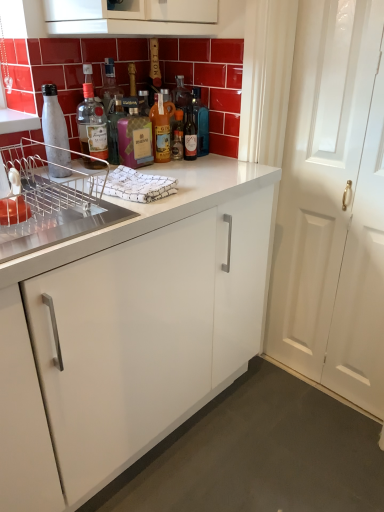
Question: Does pink glass bottle at center, the 3th bottle positioned from the left, have a larger size compared to matte glass bottle at upper center, which is the second bottle from left to right?

Choices:
 (A) no
 (B) yes

Answer: (B)

Question: Is pink glass bottle at center, the 3th bottle positioned from the left, further to camera compared to matte glass bottle at upper center, which is the fifth bottle in right-to-left order?

Choices:
 (A) no
 (B) yes

Answer: (A)

Question: From a real-world perspective, is pink glass bottle at center, the 3th bottle positioned from the left, on top of matte glass bottle at upper center, which is the fifth bottle in right-to-left order?

Choices:
 (A) no
 (B) yes

Answer: (A)

Question: Does pink glass bottle at center, the fourth bottle from the right, lie in front of matte glass bottle at upper center, which is the second bottle from left to right?

Choices:
 (A) no
 (B) yes

Answer: (B)

Question: From a real-world perspective, is pink glass bottle at center, the fourth bottle from the right, under matte glass bottle at upper center, which is the second bottle from left to right?

Choices:
 (A) yes
 (B) no

Answer: (A)

Question: In terms of size, does matte glass bottle at center, the third bottle from the right, appear bigger or smaller than matte glass bottle at upper center, which is the second bottle from left to right?

Choices:
 (A) big
 (B) small

Answer: (A)

Question: Is matte glass bottle at center, which is the fourth bottle from left to right, inside or outside of matte glass bottle at upper center, which is the second bottle from left to right?

Choices:
 (A) inside
 (B) outside

Answer: (B)

Question: From the image's perspective, is matte glass bottle at center, the third bottle from the right, positioned above or below matte glass bottle at upper center, which is the second bottle from left to right?

Choices:
 (A) above
 (B) below

Answer: (B)

Question: In the image, is matte glass bottle at center, which is the fourth bottle from left to right, positioned in front of or behind matte glass bottle at upper center, which is the fifth bottle in right-to-left order?

Choices:
 (A) behind
 (B) front

Answer: (A)

Question: From the image's perspective, is pink glass bottle at center, the 3th bottle positioned from the left, located above or below metallic silver dish rack at left?

Choices:
 (A) above
 (B) below

Answer: (A)

Question: From a real-world perspective, relative to metallic silver dish rack at left, is pink glass bottle at center, the 3th bottle positioned from the left, vertically above or below?

Choices:
 (A) below
 (B) above

Answer: (B)

Question: From their relative heights in the image, would you say pink glass bottle at center, the 3th bottle positioned from the left, is taller or shorter than metallic silver dish rack at left?

Choices:
 (A) tall
 (B) short

Answer: (A)

Question: Based on their sizes in the image, would you say pink glass bottle at center, the fourth bottle from the right, is bigger or smaller than metallic silver dish rack at left?

Choices:
 (A) big
 (B) small

Answer: (B)

Question: Is matte glass bottle at upper center, which is the second bottle from left to right, inside the boundaries of white matte water bottle at left, which is the first bottle from left to right, or outside?

Choices:
 (A) outside
 (B) inside

Answer: (A)

Question: Relative to white matte water bottle at left, which is the first bottle from left to right, is matte glass bottle at upper center, which is the fifth bottle in right-to-left order, in front or behind?

Choices:
 (A) front
 (B) behind

Answer: (B)